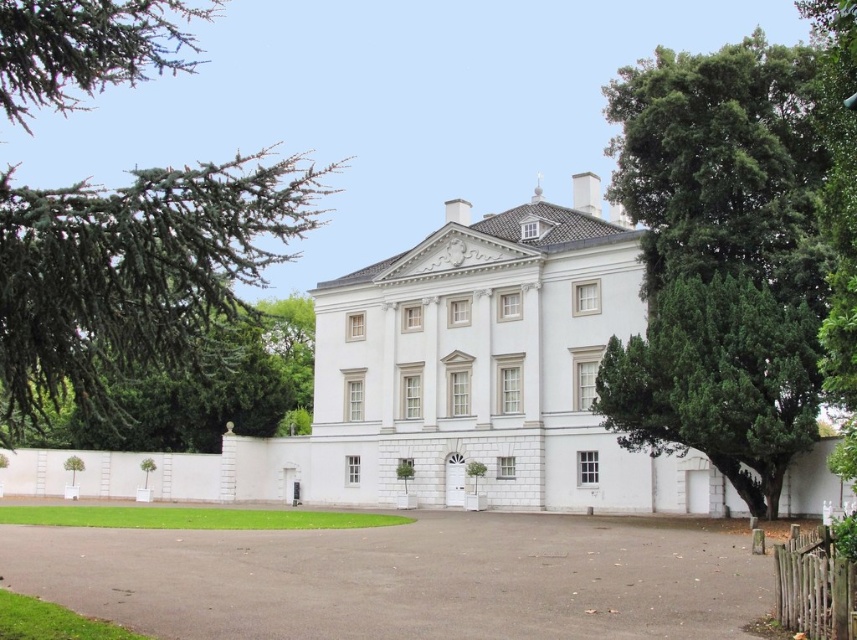
You are a visitor arriving at the property and need to park your car. You see the gray asphalt driveway at lower center and the green leafy tree at right. Which object should you drive towards to park your car?

You should drive towards the gray asphalt driveway at lower center because it is the designated parking area, while the green leafy tree at right is a tree and not suitable for parking.

From the picture: You are a gardener planning to install a new walkway between the gray asphalt driveway at lower center and the green leafy tree at right. Which object is wider so that you can decide where to place the walkway?

The gray asphalt driveway at lower center is wider than the green leafy tree at right, so the walkway should be placed near the tree to avoid the wider driveway.

You are standing at the entrance of the grand building and want to walk towards the point that is closer to you. Which point should you head towards, point (712, 278) or point (686, 292)?

You should head towards point (686, 292) because it is closer to you than point (712, 278), which is further away.